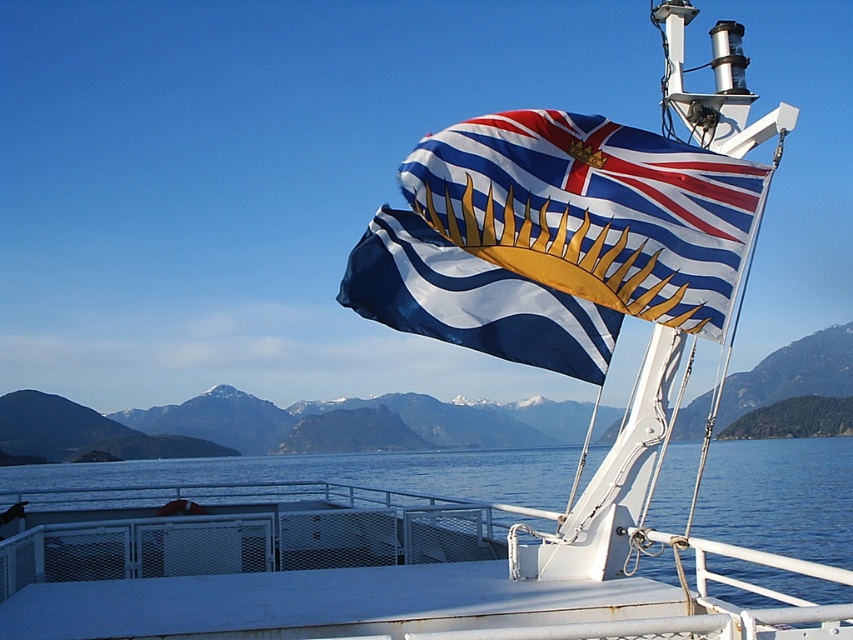
Question: Among these objects, which one is nearest to the camera?

Choices:
 (A) blue water at center
 (B) blue and white striped flag at upper center

Answer: (B)

Question: Can you confirm if blue and white striped flag at upper center is thinner than blue water at center?

Choices:
 (A) yes
 (B) no

Answer: (A)

Question: From the image, what is the correct spatial relationship of blue and white striped flag at upper center in relation to blue water at center?

Choices:
 (A) above
 (B) below

Answer: (A)

Question: Does blue and white striped flag at upper center appear on the left side of blue water at center?

Choices:
 (A) no
 (B) yes

Answer: (B)

Question: Which point is closer to the camera?

Choices:
 (A) (583, 276)
 (B) (128, 468)

Answer: (A)